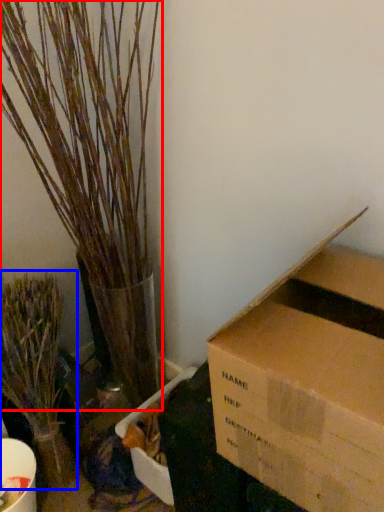
Question: Which point is further to the camera, houseplant (highlighted by a red box) or houseplant (highlighted by a blue box)?

Choices:
 (A) houseplant
 (B) houseplant

Answer: (B)